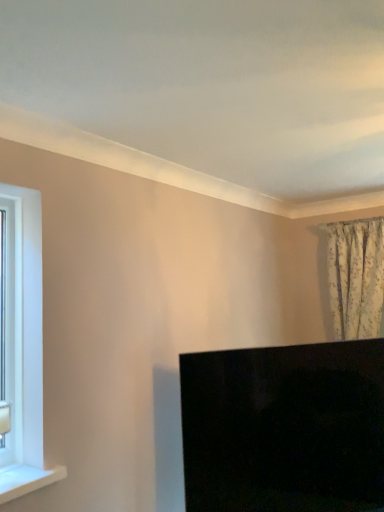
Identify the location of floral fabric curtain at upper right. The height and width of the screenshot is (512, 384). (356, 277).

This screenshot has width=384, height=512. In order to click on black glossy monitor at lower right in this screenshot , I will do `click(284, 428)`.

This screenshot has height=512, width=384. Describe the element at coordinates (284, 428) in the screenshot. I see `black glossy monitor at lower right` at that location.

This screenshot has height=512, width=384. Identify the location of floral fabric curtain at upper right. (356, 277).

Which is more to the right, white plastic window frame at left or floral fabric curtain at upper right?

floral fabric curtain at upper right.

Is floral fabric curtain at upper right at the back of white plastic window frame at left?

white plastic window frame at left is not turned away from floral fabric curtain at upper right.

Is white plastic window frame at left directly adjacent to floral fabric curtain at upper right?

white plastic window frame at left is not next to floral fabric curtain at upper right, and they're not touching.

Does white plastic window frame at left have a lesser width compared to floral fabric curtain at upper right?

Correct, the width of white plastic window frame at left is less than that of floral fabric curtain at upper right.

Is black glossy monitor at lower right bigger or smaller than white glossy window sill at lower left?

Considering their sizes, black glossy monitor at lower right takes up more space than white glossy window sill at lower left.

Is black glossy monitor at lower right turned away from white glossy window sill at lower left?

black glossy monitor at lower right does not have its back to white glossy window sill at lower left.

Considering the relative sizes of black glossy monitor at lower right and white glossy window sill at lower left in the image provided, is black glossy monitor at lower right wider than white glossy window sill at lower left?

Yes.

From a real-world perspective, is black glossy monitor at lower right positioned under white glossy window sill at lower left based on gravity?

Correct, in the physical world, black glossy monitor at lower right is lower than white glossy window sill at lower left.

Considering the sizes of objects black glossy monitor at lower right and white plastic window frame at left in the image provided, who is thinner, black glossy monitor at lower right or white plastic window frame at left?

white plastic window frame at left is thinner.

From a real-world perspective, is black glossy monitor at lower right on white plastic window frame at left?

Actually, black glossy monitor at lower right is physically below white plastic window frame at left in the real world.

Is black glossy monitor at lower right not inside white plastic window frame at left?

That's correct, black glossy monitor at lower right is outside of white plastic window frame at left.

Can you confirm if black glossy monitor at lower right is smaller than floral fabric curtain at upper right?

Incorrect, black glossy monitor at lower right is not smaller in size than floral fabric curtain at upper right.

Is black glossy monitor at lower right positioned far away from floral fabric curtain at upper right?

No, black glossy monitor at lower right is in close proximity to floral fabric curtain at upper right.

Is black glossy monitor at lower right to the right of floral fabric curtain at upper right from the viewer's perspective?

In fact, black glossy monitor at lower right is to the left of floral fabric curtain at upper right.

Which point is more forward, [18,274] or [310,400]?

The point [18,274] is closer to the camera.

Considering the sizes of objects white plastic window frame at left and black glossy monitor at lower right in the image provided, who is shorter, white plastic window frame at left or black glossy monitor at lower right?

With less height is black glossy monitor at lower right.

Which object is thinner, white plastic window frame at left or black glossy monitor at lower right?

With smaller width is white plastic window frame at left.

Can you tell me how much white plastic window frame at left and black glossy monitor at lower right differ in facing direction?

There is a 37.5-degree angle between the facing directions of white plastic window frame at left and black glossy monitor at lower right.

In the scene shown: Could you tell me if white glossy window sill at lower left is turned towards black glossy monitor at lower right?

No, white glossy window sill at lower left is not oriented towards black glossy monitor at lower right.

Are white glossy window sill at lower left and black glossy monitor at lower right located far from each other?

white glossy window sill at lower left is positioned a significant distance from black glossy monitor at lower right.

Which object is positioned more to the left, white glossy window sill at lower left or black glossy monitor at lower right?

white glossy window sill at lower left is more to the left.

Is black glossy monitor at lower right a part of floral fabric curtain at upper right?

Actually, black glossy monitor at lower right is outside floral fabric curtain at upper right.

From the image's perspective, is floral fabric curtain at upper right located beneath black glossy monitor at lower right?

No, from the image's perspective, floral fabric curtain at upper right is not below black glossy monitor at lower right.

How many degrees apart are the facing directions of floral fabric curtain at upper right and black glossy monitor at lower right?

The angle between the facing direction of floral fabric curtain at upper right and the facing direction of black glossy monitor at lower right is 53.5 degrees.

This screenshot has width=384, height=512. In order to click on window frame that is in front of the floral fabric curtain at upper right in this screenshot , I will do `click(13, 330)`.

Where is `window sill located on the left of black glossy monitor at lower right`? window sill located on the left of black glossy monitor at lower right is located at coordinates (26, 480).

Based on their spatial positions, is white plastic window frame at left or black glossy monitor at lower right further from floral fabric curtain at upper right?

white plastic window frame at left lies further to floral fabric curtain at upper right than the other object.

When comparing their distances from black glossy monitor at lower right, does white plastic window frame at left or white glossy window sill at lower left seem closer?

white glossy window sill at lower left lies closer to black glossy monitor at lower right than the other object.

Looking at the image, which one is located further to black glossy monitor at lower right, floral fabric curtain at upper right or white plastic window frame at left?

The object further to black glossy monitor at lower right is white plastic window frame at left.

Based on the photo, considering their positions, is white plastic window frame at left positioned further to white glossy window sill at lower left than black glossy monitor at lower right?

black glossy monitor at lower right lies further to white glossy window sill at lower left than the other object.

Estimate the real-world distances between objects in this image. Which object is closer to floral fabric curtain at upper right, black glossy monitor at lower right or white glossy window sill at lower left?

black glossy monitor at lower right.

Estimate the real-world distances between objects in this image. Which object is closer to black glossy monitor at lower right, white plastic window frame at left or floral fabric curtain at upper right?

floral fabric curtain at upper right.

Looking at this image, based on their spatial positions, is black glossy monitor at lower right or white plastic window frame at left closer to floral fabric curtain at upper right?

Among the two, black glossy monitor at lower right is located nearer to floral fabric curtain at upper right.

When comparing their distances from black glossy monitor at lower right, does white glossy window sill at lower left or floral fabric curtain at upper right seem further?

The object further to black glossy monitor at lower right is white glossy window sill at lower left.

The image size is (384, 512). Find the location of `window sill situated between white plastic window frame at left and black glossy monitor at lower right from left to right`. window sill situated between white plastic window frame at left and black glossy monitor at lower right from left to right is located at coordinates (26, 480).

Locate an element on the screen. Image resolution: width=384 pixels, height=512 pixels. computer monitor between white glossy window sill at lower left and floral fabric curtain at upper right from left to right is located at coordinates (284, 428).

Locate an element on the screen. window sill located between white plastic window frame at left and floral fabric curtain at upper right in the left-right direction is located at coordinates (26, 480).

The image size is (384, 512). I want to click on computer monitor between white plastic window frame at left and floral fabric curtain at upper right from left to right, so click(284, 428).